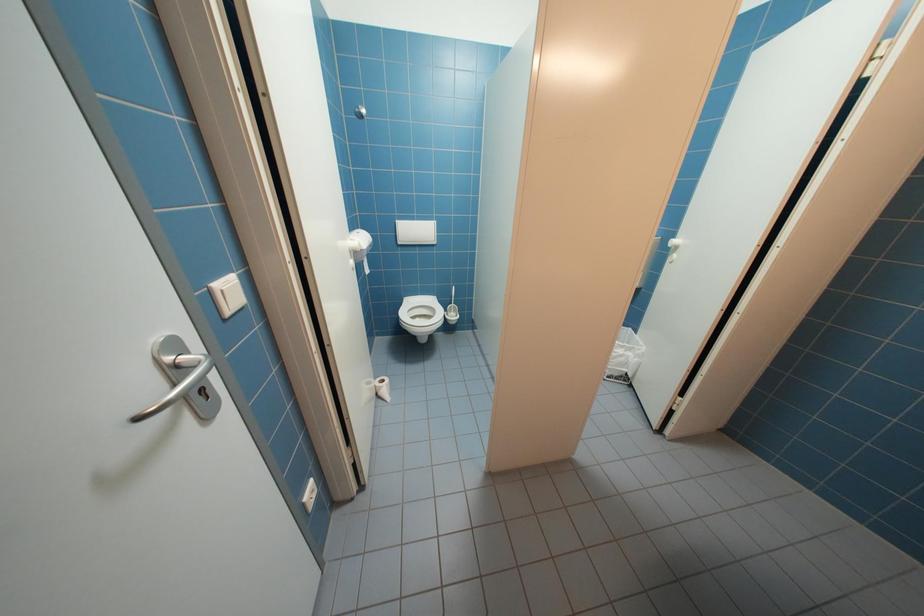
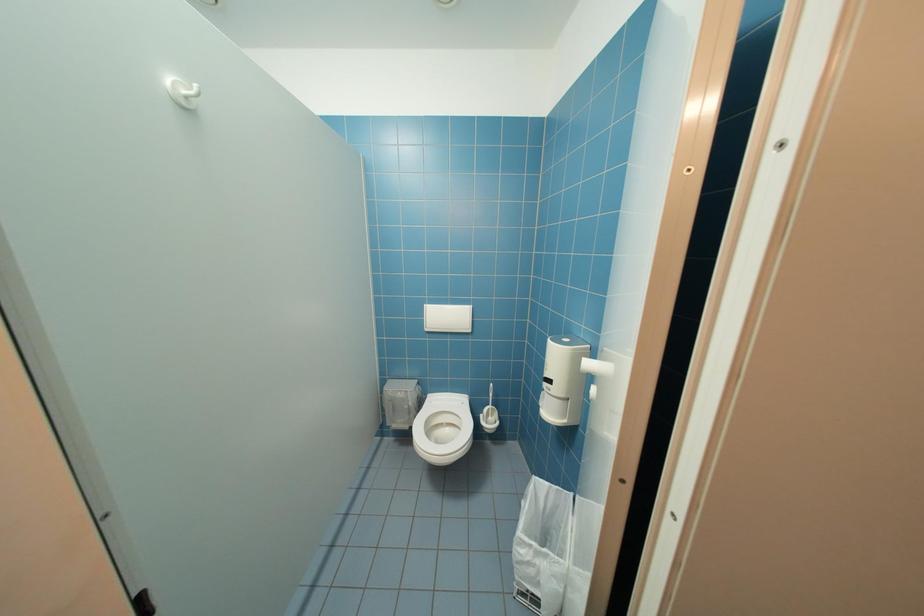
What movement of the cameraman would produce the second image?

The cameraman walked toward right, forward.